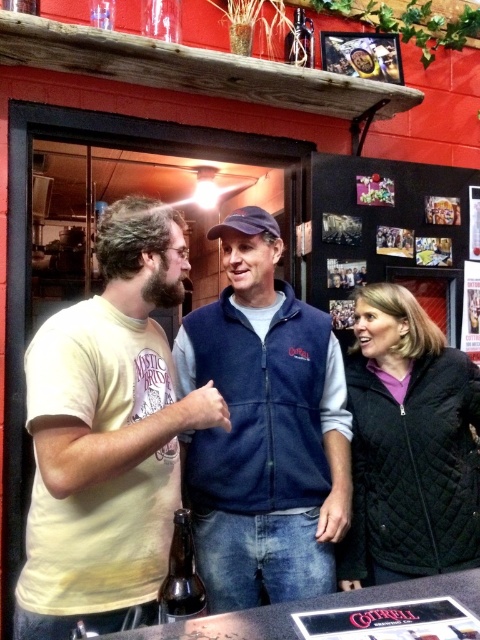
In the scene shown: You are a delivery person who needs to place a small package between the black quilted jacket at right and the brown glass bottle at center. Can the package fit in the space between them?

The distance between the black quilted jacket at right and the brown glass bottle at center is 28.47 inches, so the package can fit in the space between them as long as it is smaller than 28.47 inches in length.